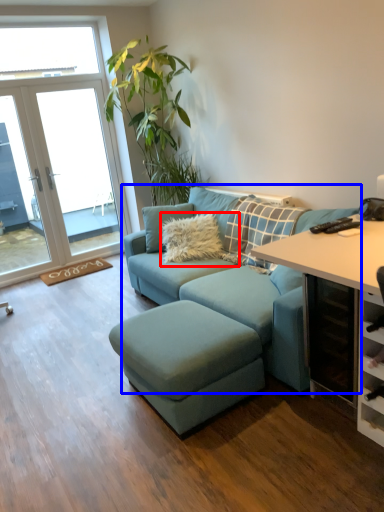
Question: Among these objects, which one is nearest to the camera, pillow (highlighted by a red box) or studio couch (highlighted by a blue box)?

Choices:
 (A) pillow
 (B) studio couch

Answer: (B)